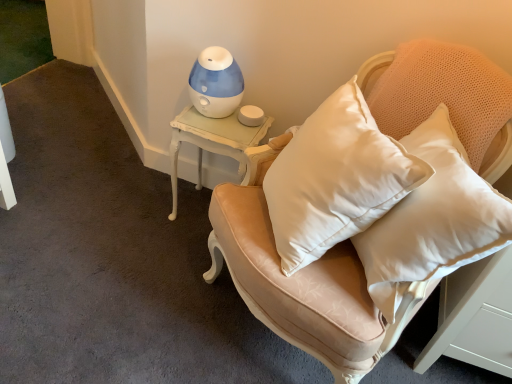
Question: Should I look upward or downward to see blue plastic humidifier at upper center?

Choices:
 (A) up
 (B) down

Answer: (A)

Question: From a real-world perspective, does satin beige armchair at center sit lower than white painted wood side table at upper left?

Choices:
 (A) yes
 (B) no

Answer: (B)

Question: From the image's perspective, is satin beige armchair at center beneath white painted wood side table at upper left?

Choices:
 (A) yes
 (B) no

Answer: (A)

Question: Is satin beige armchair at center next to white painted wood side table at upper left and touching it?

Choices:
 (A) yes
 (B) no

Answer: (B)

Question: Is satin beige armchair at center facing towards white painted wood side table at upper left?

Choices:
 (A) no
 (B) yes

Answer: (A)

Question: Is satin beige armchair at center positioned far away from white painted wood side table at upper left?

Choices:
 (A) yes
 (B) no

Answer: (B)

Question: From a real-world perspective, is satin beige armchair at center over white painted wood side table at upper left?

Choices:
 (A) yes
 (B) no

Answer: (A)

Question: Is satin beige armchair at center completely or partially inside white painted wood side table at upper left?

Choices:
 (A) no
 (B) yes

Answer: (A)

Question: Is white painted wood side table at upper left not inside satin beige armchair at center?

Choices:
 (A) no
 (B) yes

Answer: (B)

Question: Considering the relative sizes of white painted wood side table at upper left and satin beige armchair at center in the image provided, is white painted wood side table at upper left bigger than satin beige armchair at center?

Choices:
 (A) no
 (B) yes

Answer: (A)

Question: Is white painted wood side table at upper left aimed at satin beige armchair at center?

Choices:
 (A) yes
 (B) no

Answer: (B)

Question: Is white painted wood side table at upper left with satin beige armchair at center?

Choices:
 (A) no
 (B) yes

Answer: (A)

Question: Considering the relative sizes of white painted wood side table at upper left and satin beige armchair at center in the image provided, is white painted wood side table at upper left wider than satin beige armchair at center?

Choices:
 (A) no
 (B) yes

Answer: (A)

Question: Does blue plastic humidifier at upper center lie behind white painted wood side table at upper left?

Choices:
 (A) yes
 (B) no

Answer: (B)